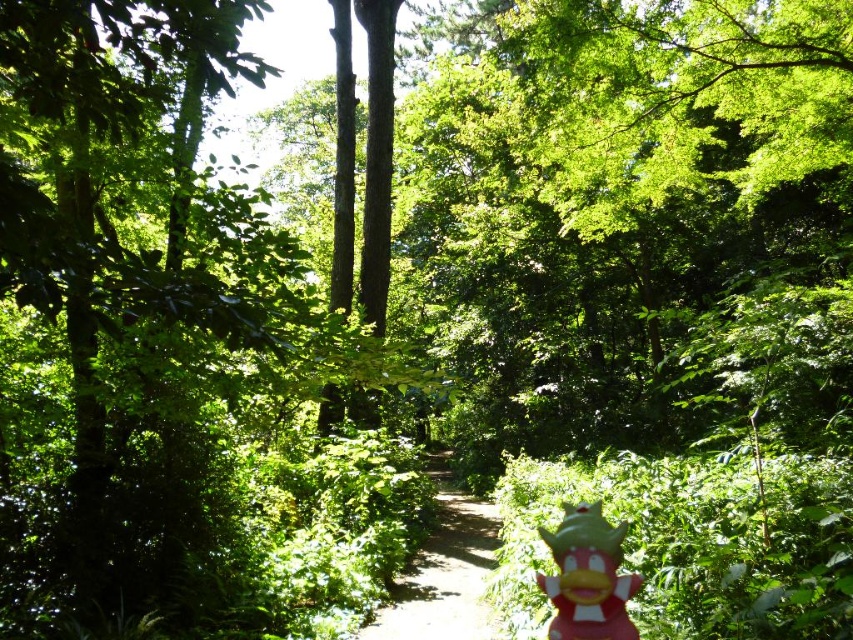
Question: Can you confirm if dirt path at center is bigger than rubber duck at lower right?

Choices:
 (A) yes
 (B) no

Answer: (A)

Question: Does dirt path at center have a lesser width compared to rubber duck at lower right?

Choices:
 (A) yes
 (B) no

Answer: (B)

Question: Which of the following is the closest to the observer?

Choices:
 (A) (596, 576)
 (B) (422, 620)

Answer: (A)

Question: Which point is farther from the camera taking this photo?

Choices:
 (A) (608, 595)
 (B) (445, 536)

Answer: (B)

Question: Which of the following is the closest to the observer?

Choices:
 (A) (433, 634)
 (B) (582, 554)

Answer: (B)

Question: Can you confirm if dirt path at center is positioned to the left of rubber duck at lower right?

Choices:
 (A) yes
 (B) no

Answer: (A)